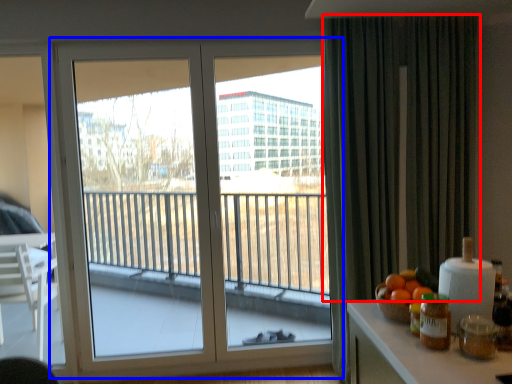
Question: Which object appears farthest to the camera in this image, curtain (highlighted by a red box) or window (highlighted by a blue box)?

Choices:
 (A) curtain
 (B) window

Answer: (B)